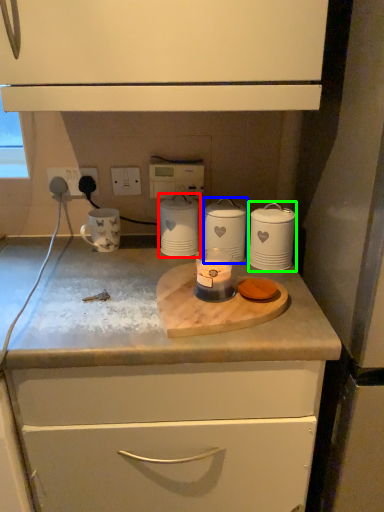
Question: Which object is positioned closest to home appliance (highlighted by a red box)? Select from home appliance (highlighted by a blue box) and home appliance (highlighted by a green box).

Choices:
 (A) home appliance
 (B) home appliance

Answer: (A)